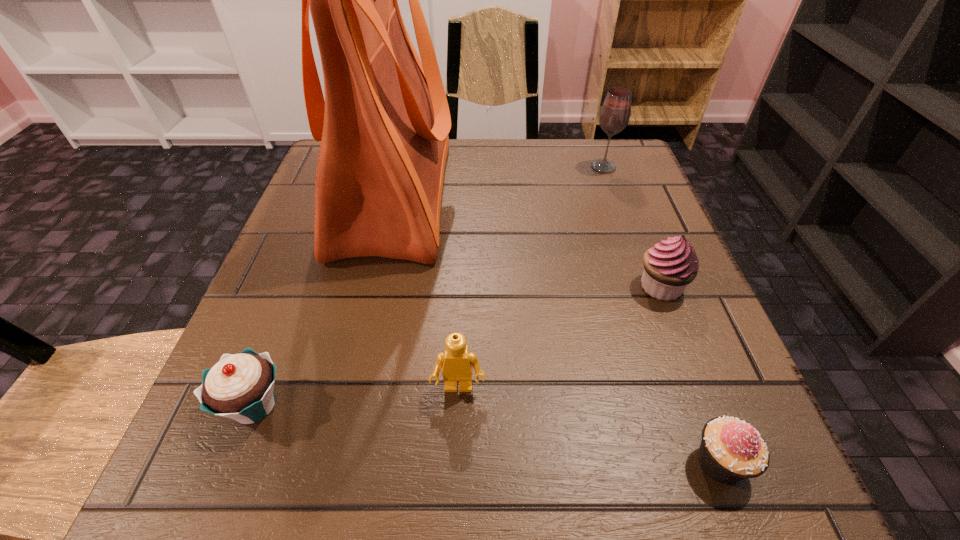
Identify which object is the closest to the Lego. Please provide its 2D coordinates. Your answer should be formatted as a tuple, i.e. [(x, y)], where the tuple contains the x and y coordinates of a point satisfying the conditions above.

[(241, 386)]

This screenshot has width=960, height=540. Find the location of `object that ranks as the fourth closest to the farthest cupcake`. object that ranks as the fourth closest to the farthest cupcake is located at coordinates (384, 125).

Locate an element on the screen. The width and height of the screenshot is (960, 540). cupcake that is the third nearest to the Lego is located at coordinates (669, 266).

Locate which cupcake is the closest to the glass drink container. Please provide its 2D coordinates. Your answer should be formatted as a tuple, i.e. [(x, y)], where the tuple contains the x and y coordinates of a point satisfying the conditions above.

[(669, 266)]

You are a GUI agent. You are given a task and a screenshot of the screen. Output one action in this format:
    pyautogui.click(x=<x>, y=<y>)
    Task: Click on the free space that satisfies the following two spatial constraints: 1. on the front side of the glass drink container; 2. on the front pocket of the shopping bag
    The width and height of the screenshot is (960, 540).
    Given the screenshot: What is the action you would take?
    pyautogui.click(x=613, y=195)